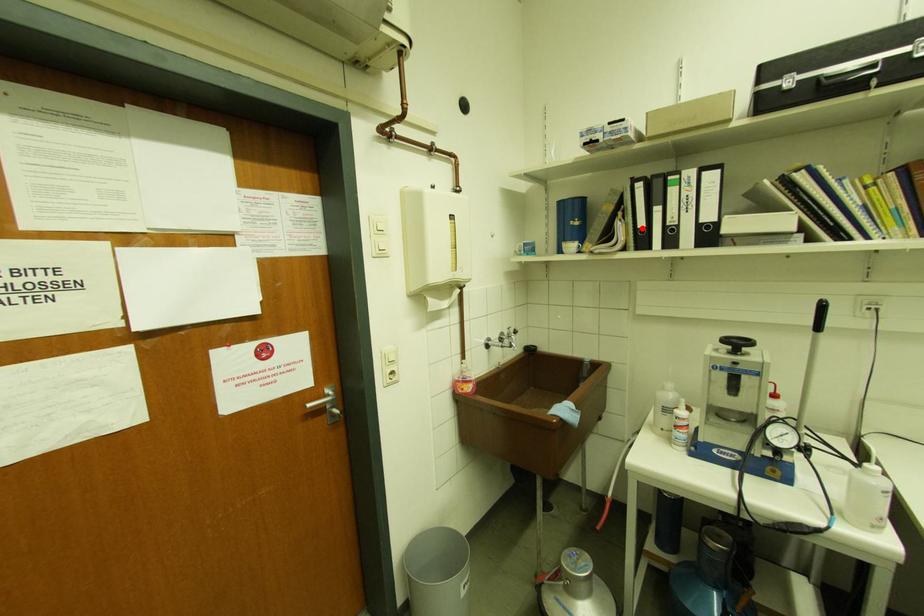
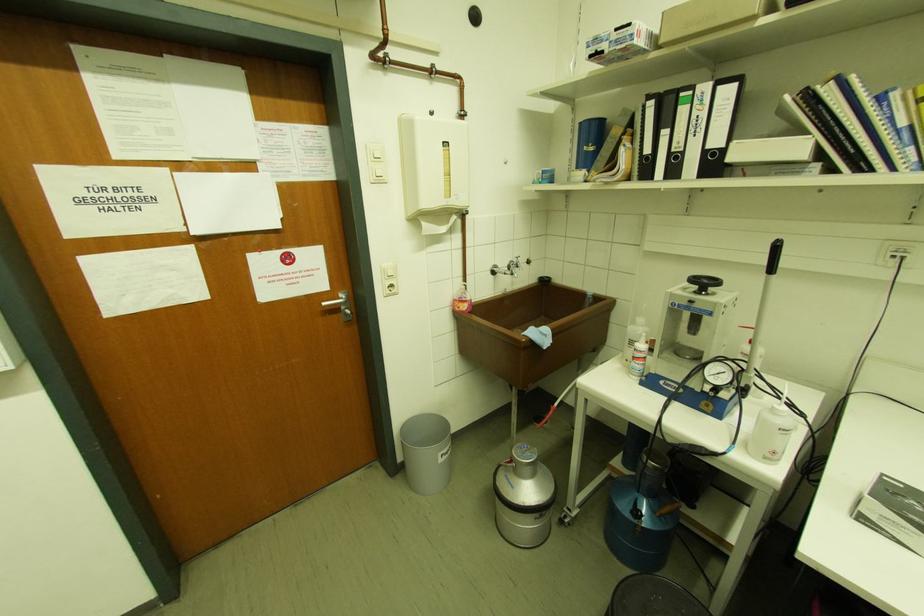
Question: I am providing you with two images of the same scene from different viewpoints. A red point is marked on the first image. Can you still see the location of the red point in image 2?

Choices:
 (A) Yes
 (B) No

Answer: (A)